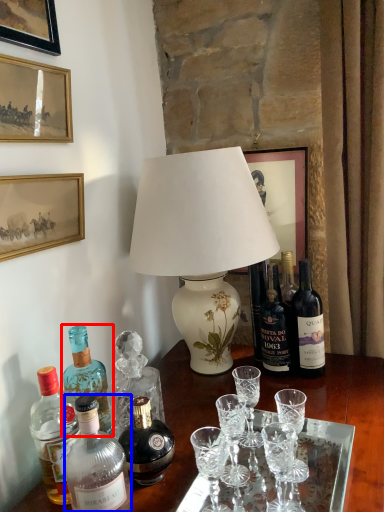
Question: Among these objects, which one is farthest to the camera, bottle (highlighted by a red box) or bottle (highlighted by a blue box)?

Choices:
 (A) bottle
 (B) bottle

Answer: (A)